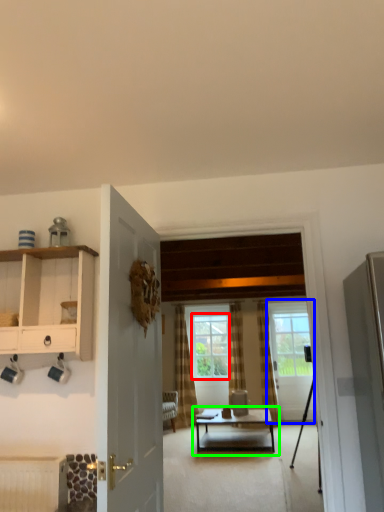
Question: Which object is the farthest from window (highlighted by a red box)? Choose among these: door (highlighted by a blue box) or coffee table (highlighted by a green box).

Choices:
 (A) door
 (B) coffee table

Answer: (B)